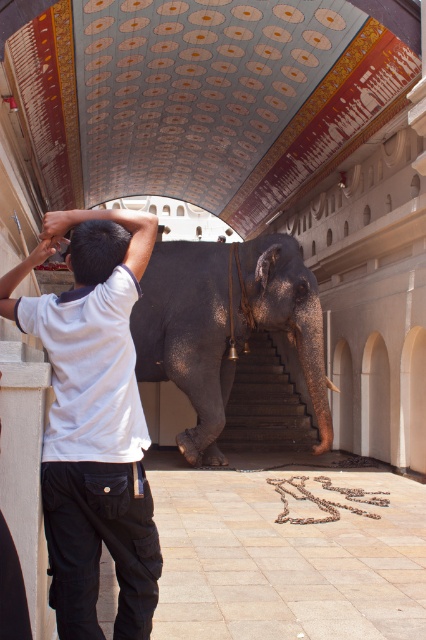
Looking at this image, you are standing in the temple and want to place a small offering on the floor. The offering must be placed exactly where the white cotton shirt at left is located. According to the coordinates provided, where should you place the offering?

Place the offering at coordinates point (94, 419) where the white cotton shirt at left is located.